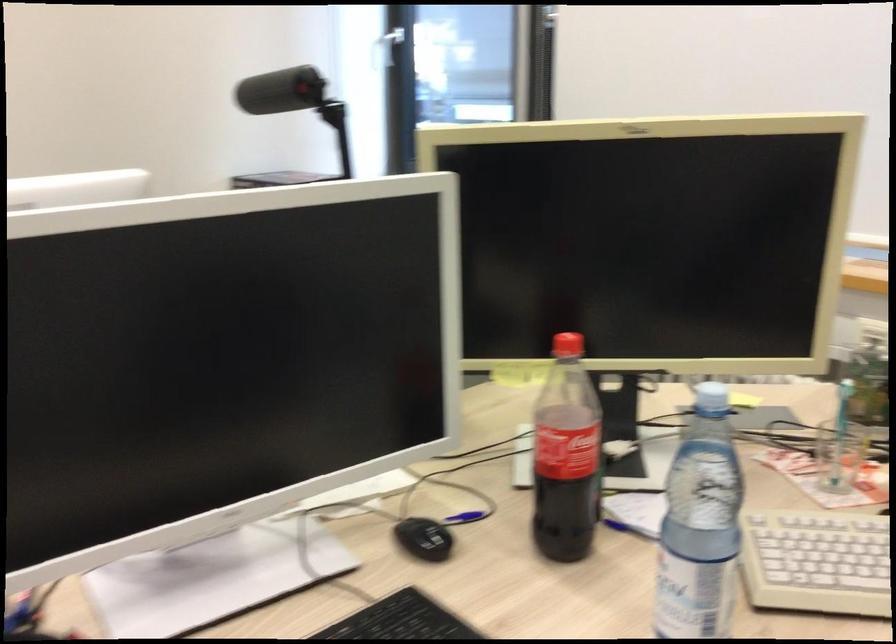
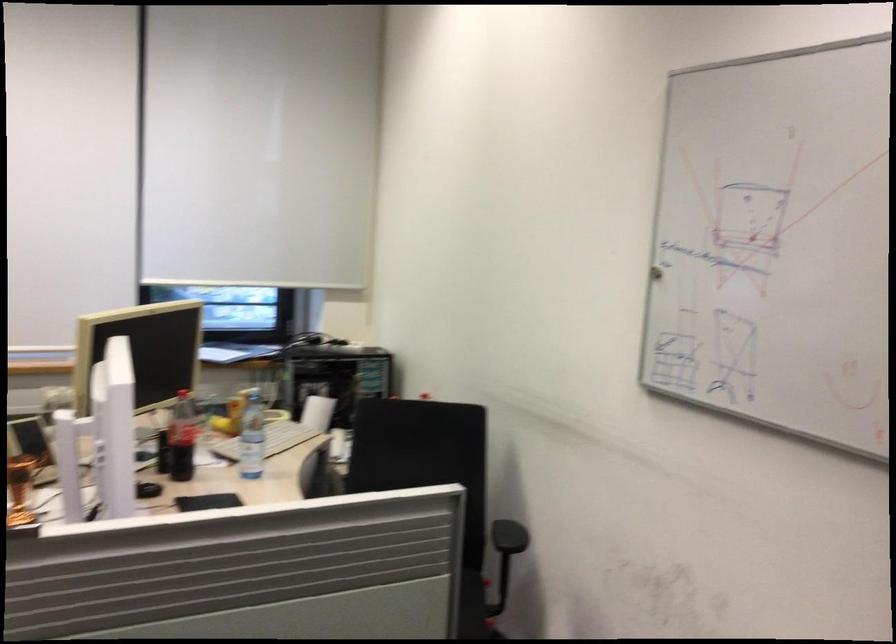
Question: I am providing you with two images of the same scene from different viewpoints. Which of the following objects are not visible in image2?

Choices:
 (A) clear water bottle
 (B) clear glass cup
 (C) chair armrest
 (D) silver roll of tape

Answer: (B)